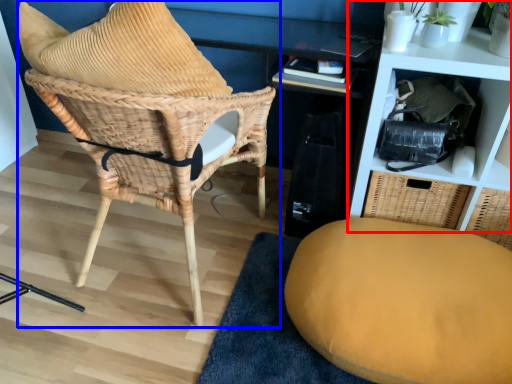
Question: Which point is closer to the camera, shelf (highlighted by a red box) or chair (highlighted by a blue box)?

Choices:
 (A) shelf
 (B) chair

Answer: (B)